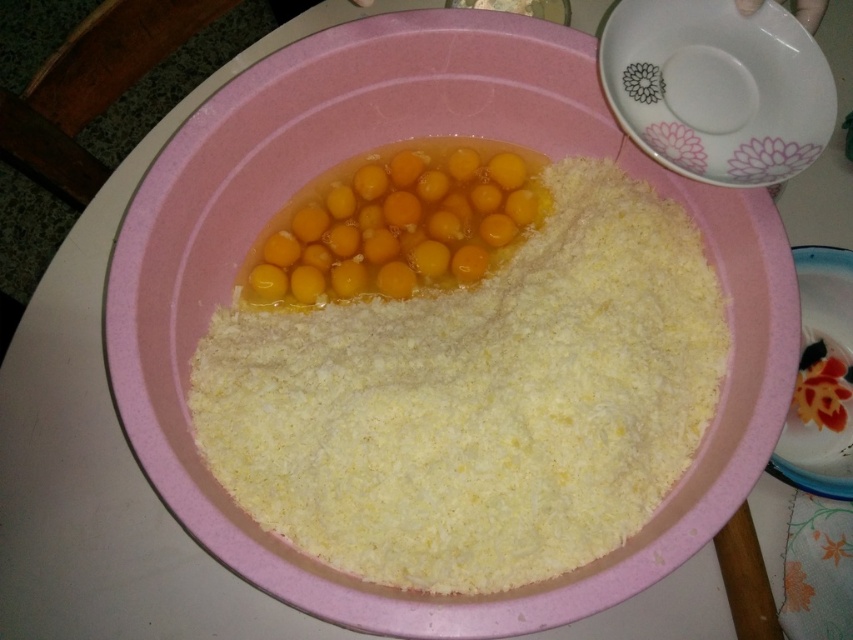
Based on the photo, is white ceramic plate at upper right thinner than yellow/yellowish/golden/yolkish/yellowish/yellowish-golden/yellowish-golden/yellowish-golden/yellowish-golden/yellowish-golden/yellowish-golden/yellowish-golden/yellowish-golden/yellowish-golden/yellowish-golden/yellowish-golden/yellowish-golden/yellowish-golden/yellowish-golden/yellowish-golden/yellowish-golden/yellowish-golden/yellowish-golden/yellowish-golden/y?

Indeed, white ceramic plate at upper right has a lesser width compared to yellow/yellowish/golden/yolkish/yellowish/yellowish-golden/yellowish-golden/yellowish-golden/yellowish-golden/yellowish-golden/yellowish-golden/yellowish-golden/yellowish-golden/yellowish-golden/yellowish-golden/yellowish-golden/yellowish-golden/yellowish-golden/yellowish-golden/yellowish-golden/yellowish-golden/yellowish-golden/yellowish-golden/yellowish-golden/y.

Can you confirm if white ceramic plate at upper right is positioned below yellow/yellowish/golden/yolkish/yellowish/yellowish-golden/yellowish-golden/yellowish-golden/yellowish-golden/yellowish-golden/yellowish-golden/yellowish-golden/yellowish-golden/yellowish-golden/yellowish-golden/yellowish-golden/yellowish-golden/yellowish-golden/yellowish-golden/yellowish-golden/yellowish-golden/yellowish-golden/yellowish-golden/yellowish-golden/y?

No.

Measure the distance between white ceramic plate at upper right and camera.

white ceramic plate at upper right and camera are 33.25 inches apart.

Image resolution: width=853 pixels, height=640 pixels. What are the coordinates of `white ceramic plate at upper right` in the screenshot? It's located at point(717,88).

How much distance is there between yellow powder at center and white ceramic plate at upper right?

They are 10.63 inches apart.

Which of these two, yellow powder at center or white ceramic plate at upper right, stands shorter?

Standing shorter between the two is white ceramic plate at upper right.

Based on the photo, who is more forward, [415,536] or [775,125]?

Point [415,536] is more forward.

I want to click on yellow powder at center, so click(x=479, y=401).

Is white ceramic plate at upper right to the right of porcelain plate at lower right from the viewer's perspective?

No, white ceramic plate at upper right is not to the right of porcelain plate at lower right.

Is white ceramic plate at upper right taller than porcelain plate at lower right?

In fact, white ceramic plate at upper right may be shorter than porcelain plate at lower right.

Who is more distant from viewer, (717, 72) or (828, 273)?

The point (828, 273) is more distant.

You are a GUI agent. You are given a task and a screenshot of the screen. Output one action in this format:
    pyautogui.click(x=<x>, y=<y>)
    Task: Click on the white ceramic plate at upper right
    
    Given the screenshot: What is the action you would take?
    pyautogui.click(x=717, y=88)